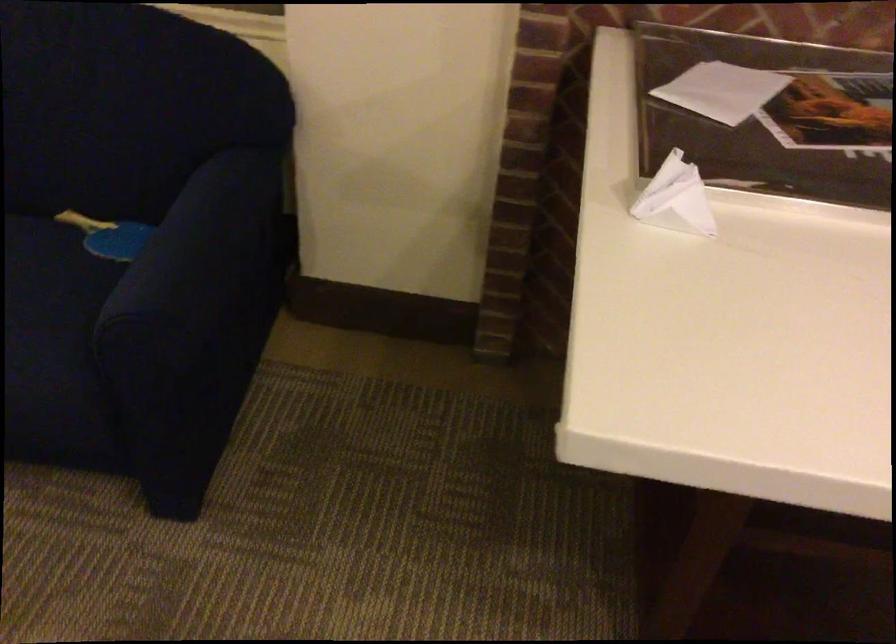
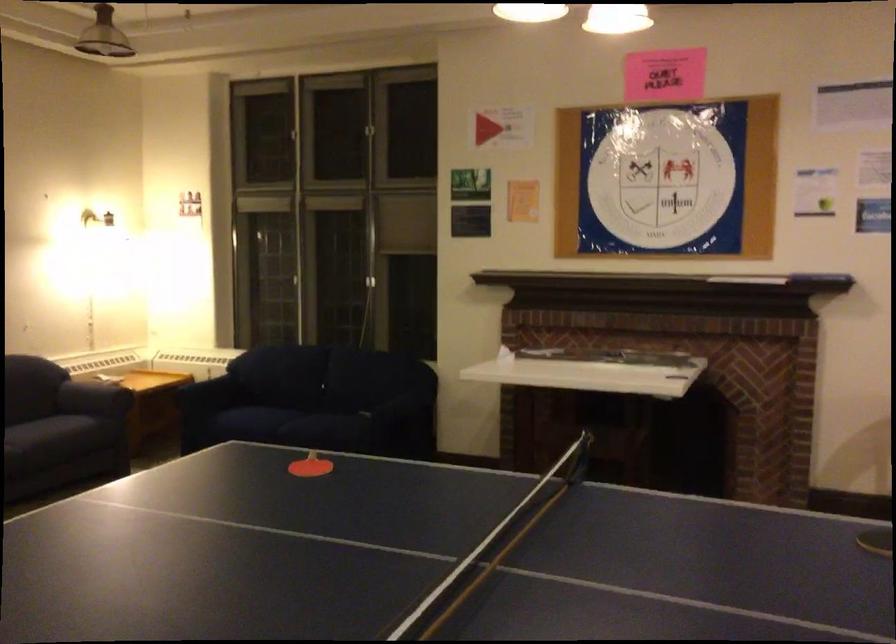
Question: I am providing you with two images of the same scene from different viewpoints. Please identify which objects are invisible in image2.

Choices:
 (A) dark sofa armrest
 (B) dark sofa sitting surface
 (C) green wine bottle
 (D) blue ping pong paddle

Answer: (D)